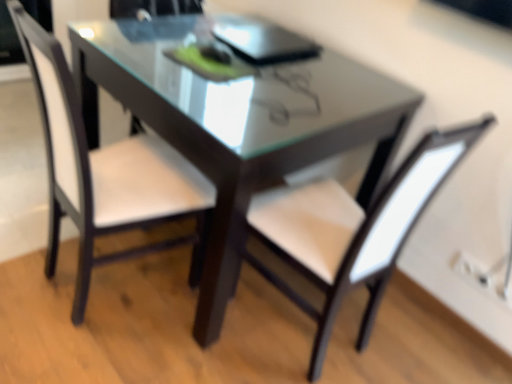
You are a GUI agent. You are given a task and a screenshot of the screen. Output one action in this format:
    pyautogui.click(x=<x>, y=<y>)
    Task: Click on the vacant space in front of white leather chair at center, the second chair from the right
    This screenshot has height=384, width=512.
    Given the screenshot: What is the action you would take?
    pyautogui.click(x=85, y=341)